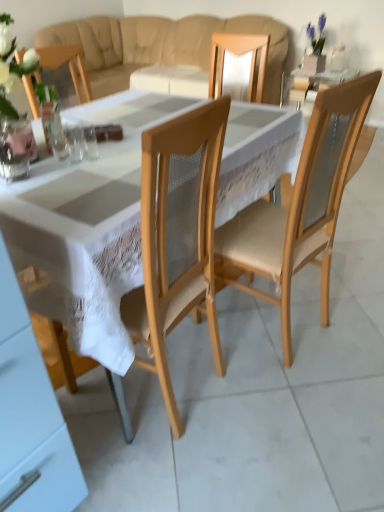
Question: Which direction should I rotate to face clear glass cup at center, positioned as the 1th tableware in right-to-left order, — up or down?

Choices:
 (A) up
 (B) down

Answer: (A)

Question: Is clear glass at center, which ranks as the 2th tableware in right-to-left order, next to clear glass at center, which is counted as the third tableware, starting from the right, and touching it?

Choices:
 (A) no
 (B) yes

Answer: (B)

Question: Can you confirm if clear glass at center, marked as the 2th tableware in a left-to-right arrangement, is smaller than clear glass at center, the 1th tableware from the left?

Choices:
 (A) no
 (B) yes

Answer: (A)

Question: Is clear glass at center, marked as the 2th tableware in a left-to-right arrangement, wider than clear glass at center, which is counted as the third tableware, starting from the right?

Choices:
 (A) yes
 (B) no

Answer: (A)

Question: Is clear glass at center, which ranks as the 2th tableware in right-to-left order, turned away from clear glass at center, the 1th tableware from the left?

Choices:
 (A) yes
 (B) no

Answer: (A)

Question: From a real-world perspective, is clear glass at center, marked as the 2th tableware in a left-to-right arrangement, under clear glass at center, which is counted as the third tableware, starting from the right?

Choices:
 (A) no
 (B) yes

Answer: (A)

Question: Is clear glass at center, which is counted as the third tableware, starting from the right, located within clear glass at center, marked as the 2th tableware in a left-to-right arrangement?

Choices:
 (A) yes
 (B) no

Answer: (B)

Question: Is white lace tablecloth at center at the back of clear glass cup at center, positioned as the 1th tableware in right-to-left order?

Choices:
 (A) yes
 (B) no

Answer: (B)

Question: Is the position of clear glass cup at center, positioned as the 1th tableware in right-to-left order, less distant than that of white lace tablecloth at center?

Choices:
 (A) yes
 (B) no

Answer: (B)

Question: Is clear glass cup at center, positioned as the 1th tableware in right-to-left order, to the right of white lace tablecloth at center from the viewer's perspective?

Choices:
 (A) no
 (B) yes

Answer: (A)

Question: Is clear glass cup at center, the third tableware positioned from the left, bigger than white lace tablecloth at center?

Choices:
 (A) no
 (B) yes

Answer: (A)

Question: From a real-world perspective, is clear glass cup at center, the third tableware positioned from the left, below white lace tablecloth at center?

Choices:
 (A) yes
 (B) no

Answer: (B)

Question: Considering the relative sizes of clear glass cup at center, positioned as the 1th tableware in right-to-left order, and white lace tablecloth at center in the image provided, is clear glass cup at center, positioned as the 1th tableware in right-to-left order, taller than white lace tablecloth at center?

Choices:
 (A) yes
 (B) no

Answer: (B)

Question: Can you confirm if white lace tablecloth at center is positioned to the left of clear glass at center, marked as the 2th tableware in a left-to-right arrangement?

Choices:
 (A) no
 (B) yes

Answer: (A)